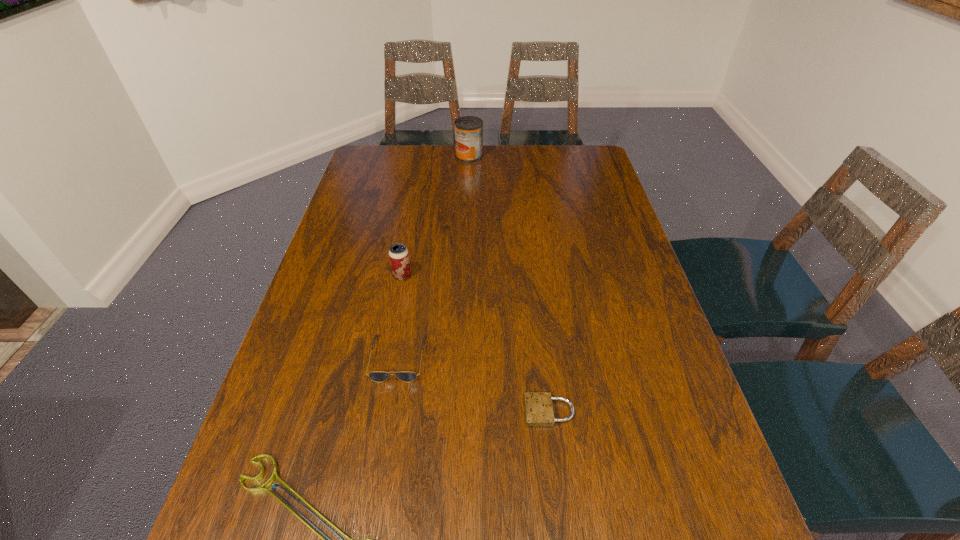
What are the coordinates of `free space located on the front-facing side of the third tallest object` in the screenshot? It's located at 379,471.

Where is `free space located 0.070m on the keyhole side of the second shortest object`? The image size is (960, 540). free space located 0.070m on the keyhole side of the second shortest object is located at coordinates (491, 411).

Locate an element on the screen. The width and height of the screenshot is (960, 540). free space located on the keyhole side of the second shortest object is located at coordinates (384, 411).

At what (x,y) coordinates should I click in order to perform the action: click on free location located 0.310m on the keyhole side of the second shortest object. Please return your answer as a coordinate pair (x, y). Looking at the image, I should click on [x=374, y=411].

In order to click on object situated at the far edge in this screenshot , I will do `click(468, 129)`.

Find the location of `free spot at the far edge of the desktop`. free spot at the far edge of the desktop is located at coordinates (412, 155).

At what (x,y) coordinates should I click in order to perform the action: click on vacant area at the left edge. Please return your answer as a coordinate pair (x, y). Looking at the image, I should click on (338, 345).

Locate an element on the screen. This screenshot has width=960, height=540. vacant space at the right edge is located at coordinates (610, 349).

In the image, there is a desktop. Identify the location of vacant space at the far left corner. This screenshot has width=960, height=540. (364, 160).

Where is `vacant space at the far right corner of the desktop`? vacant space at the far right corner of the desktop is located at coordinates (566, 173).